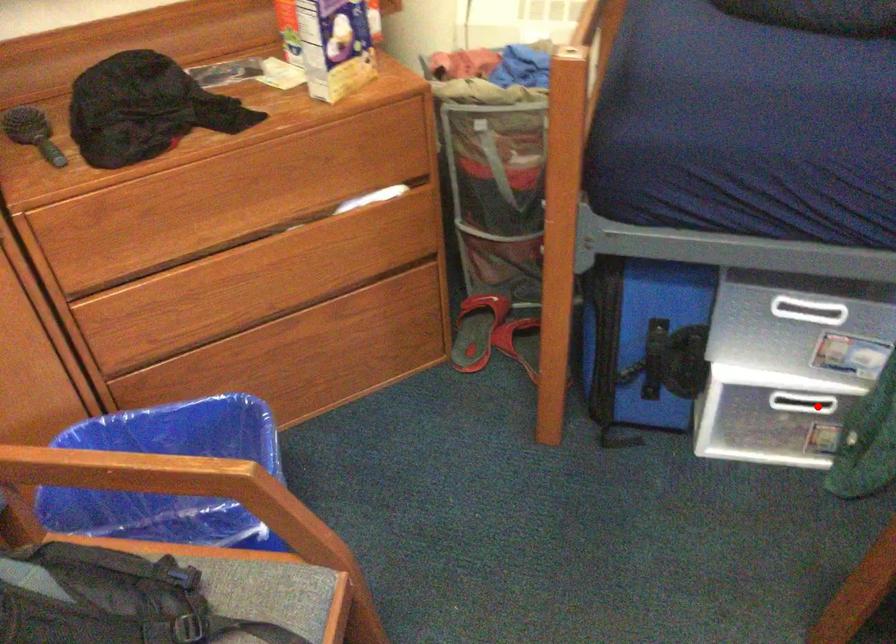
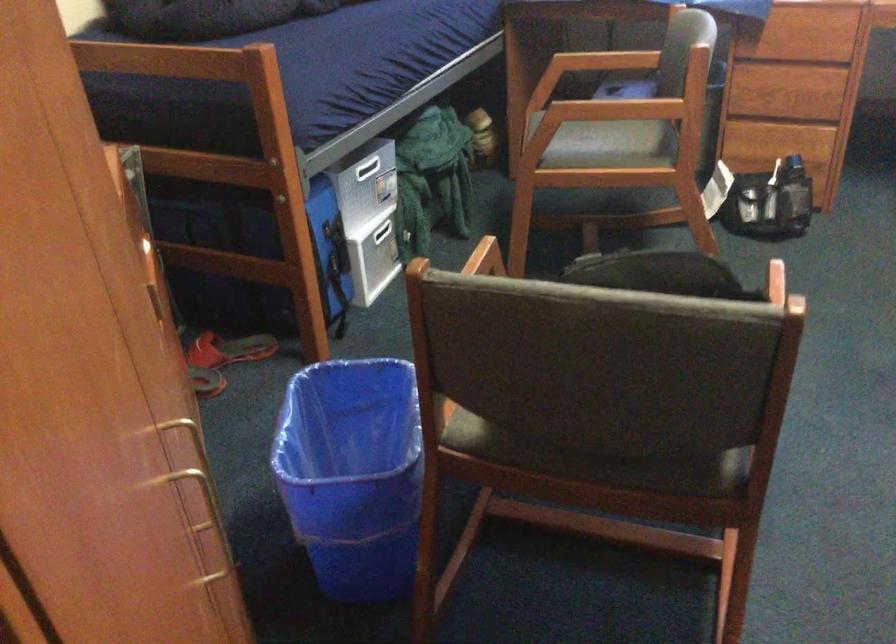
Question: I am providing you with two images of the same scene from different viewpoints. Image1 has a red point marked. In image2, the corresponding 3D location appears at what relative position? Reply with the corresponding letter.

Choices:
 (A) Closer
 (B) Farther

Answer: (B)